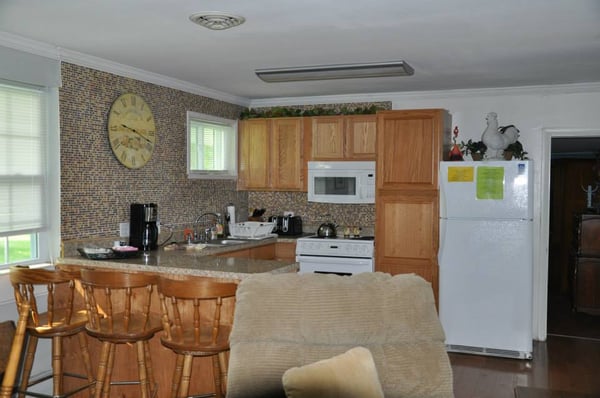
I want to click on countertop, so click(x=185, y=258).